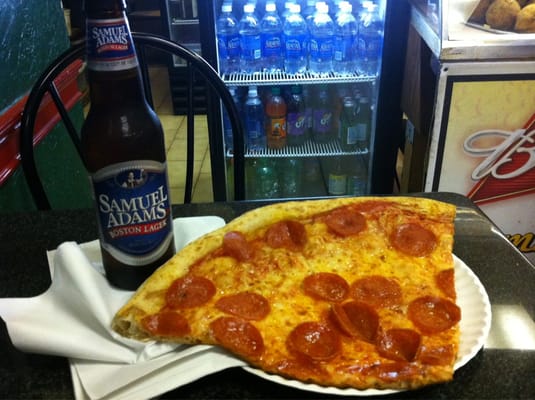
Locate an element on the screen. Image resolution: width=535 pixels, height=400 pixels. corner of hot food display is located at coordinates (458, 51).